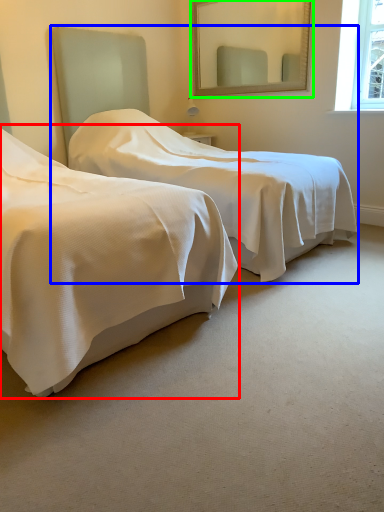
Question: Based on their relative distances, which object is nearer to bed (highlighted by a red box)? Choose from bed (highlighted by a blue box) and mirror (highlighted by a green box).

Choices:
 (A) bed
 (B) mirror

Answer: (A)